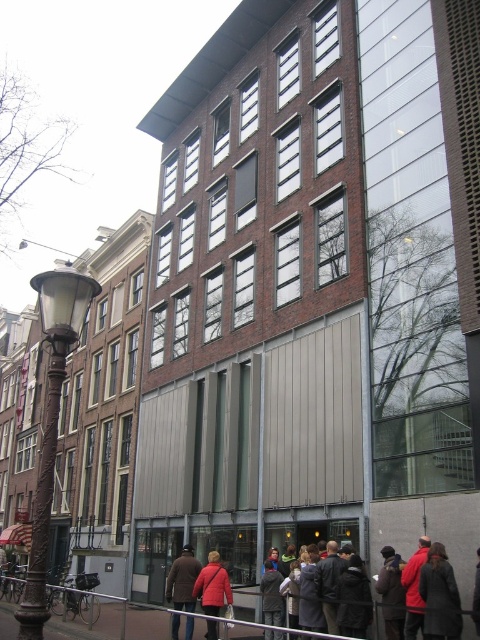
You are a photographer trying to capture both the red jacket at center and the brown leather jacket at lower center in a single shot. Given their sizes, which jacket will appear smaller in the photo?

The red jacket at center occupies less space than the brown leather jacket at lower center, so it will appear smaller in the photo.

You are standing at the entrance of the building and want to find the red jacket at center. According to the coordinates provided, where should you look relative to the entrance?

The red jacket at center is located at coordinates point (432,593), which means it is positioned to the right and slightly above the entrance relative to the entrance.

You are standing on the street looking at the building. There are two points marked on the building facade. The first point is at coordinate point (173, 584) and the second is at point (218, 593). Which point is closer to you?

Point (173, 584) is closer to you because it is further to the viewer than point (218, 593).